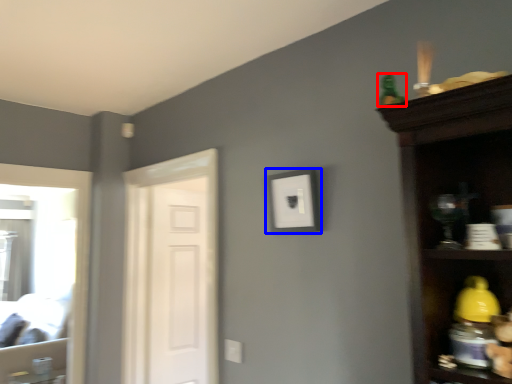
Question: Which object is closer to the camera taking this photo, toy (highlighted by a red box) or picture frame (highlighted by a blue box)?

Choices:
 (A) toy
 (B) picture frame

Answer: (A)